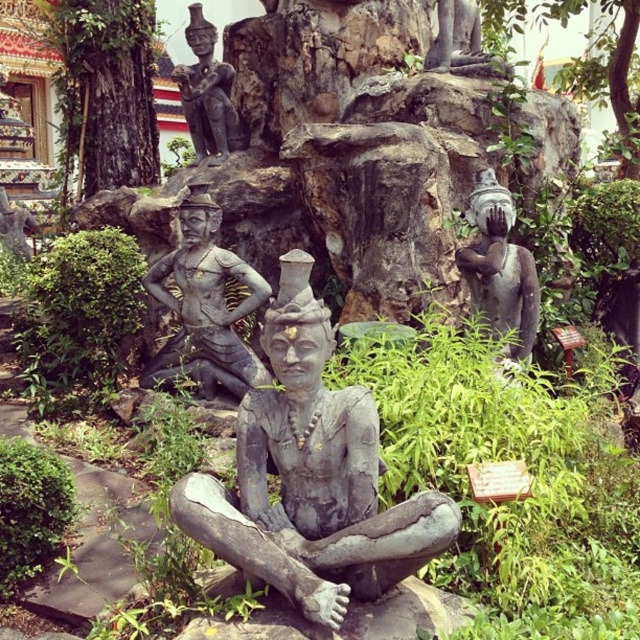
Question: Which point is farther to the camera?

Choices:
 (A) (349, 444)
 (B) (225, 141)
 (C) (595, 83)

Answer: (C)

Question: Is matte gray statue at center bigger than green leafy tree at upper right?

Choices:
 (A) yes
 (B) no

Answer: (B)

Question: Among these points, which one is farthest from the camera?

Choices:
 (A) tap(492, 227)
 (B) tap(224, 134)

Answer: (B)

Question: Which point is farther from the camera taking this photo?

Choices:
 (A) (497, 10)
 (B) (356, 444)
 (C) (496, 323)

Answer: (A)

Question: Does matte gray statue at center have a greater width compared to matte gray statue at upper center?

Choices:
 (A) no
 (B) yes

Answer: (B)

Question: Does gray stone statue at center come behind green leafy tree at upper right?

Choices:
 (A) no
 (B) yes

Answer: (A)